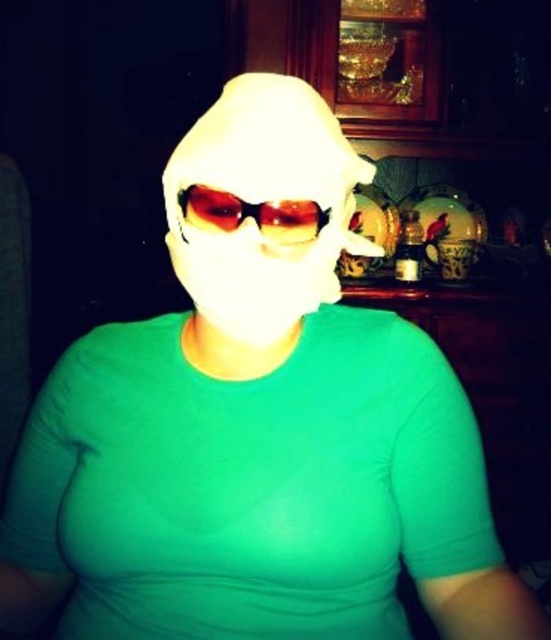
Locate an element on the screen. Image resolution: width=551 pixels, height=640 pixels. white matte mask at center is located at coordinates (262, 205).

Can you confirm if white matte mask at center is positioned below translucent amber lens goggles at center?

No.

Locate an element on the screen. The image size is (551, 640). white matte mask at center is located at coordinates (262, 205).